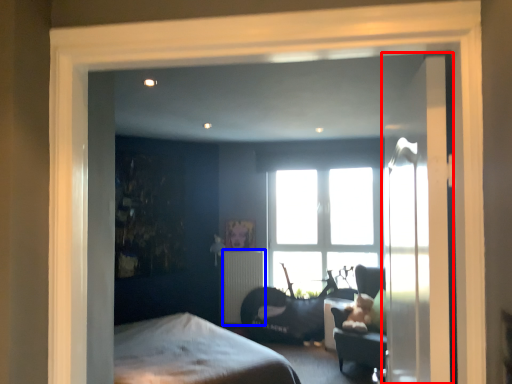
Question: Among these objects, which one is nearest to the camera, door (highlighted by a red box) or radiator (highlighted by a blue box)?

Choices:
 (A) door
 (B) radiator

Answer: (A)